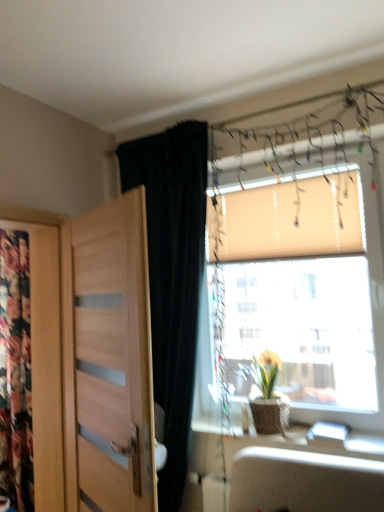
Question: From a real-world perspective, is wooden blinds at upper right positioned above or below floral fabric at left?

Choices:
 (A) above
 (B) below

Answer: (A)

Question: Is point (236, 202) positioned closer to the camera than point (3, 260)?

Choices:
 (A) closer
 (B) farther

Answer: (A)

Question: Which object is the closest to the light brown wood door at left?

Choices:
 (A) wooden blinds at upper right
 (B) floral fabric at left
 (C) beige fabric blind at upper right
 (D) green leafy plant in woven basket at window
 (E) black velvet curtain at left

Answer: (E)

Question: Based on their relative distances, which object is farther from the black velvet curtain at left?

Choices:
 (A) wooden blinds at upper right
 (B) green leafy plant in woven basket at window
 (C) floral fabric at left
 (D) beige fabric blind at upper right
 (E) light brown wood door at left

Answer: (C)